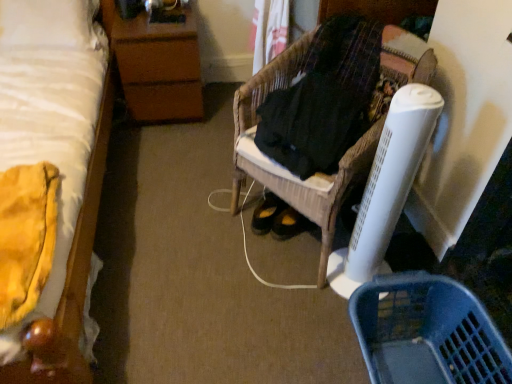
This screenshot has height=384, width=512. I want to click on vacant space positioned to the left of woven wood chair at center, so click(x=192, y=220).